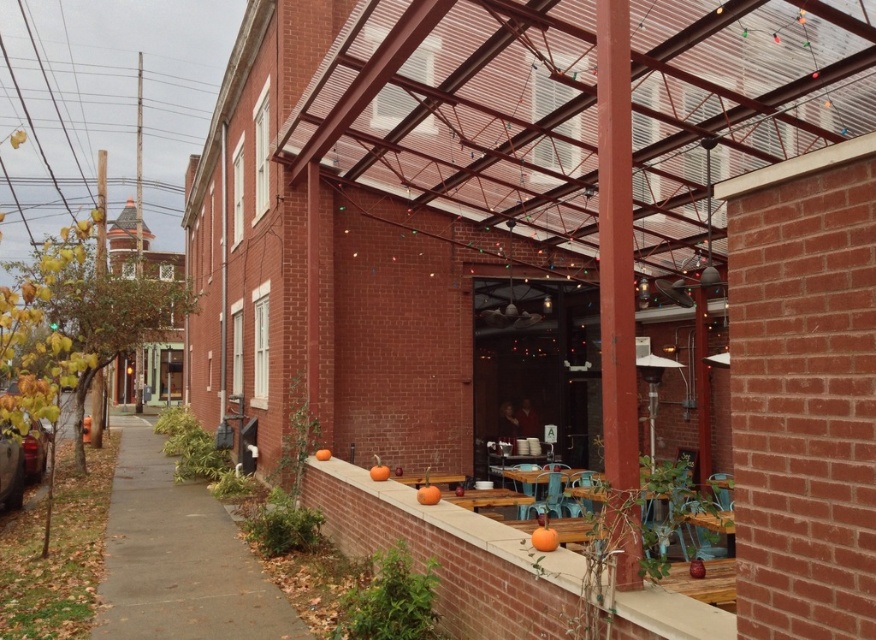
You are a delivery person approaching the entrance of the brick building. You need to place a heavy box on a surface that is closer to you. Which object should you choose between the transparent plastic canopy at upper center and the gray concrete sidewalk at lower left?

You should choose the gray concrete sidewalk at lower left because it is closer to you than the transparent plastic canopy at upper center, which is further away.